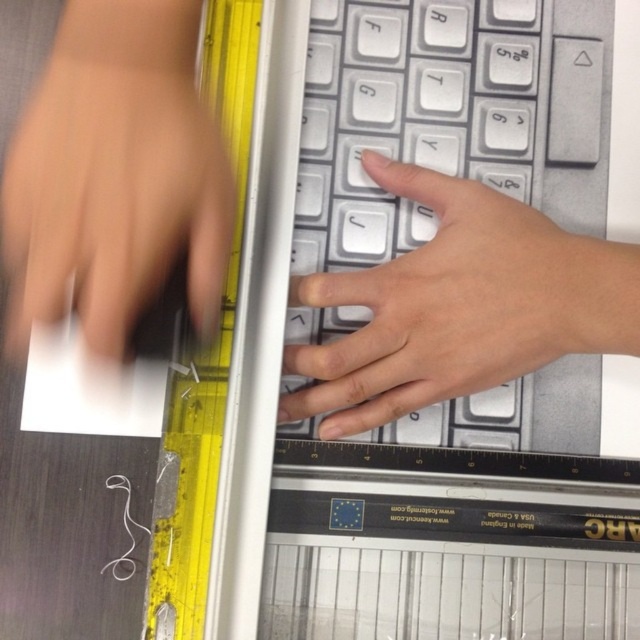
You are setting up a workspace and need to ensure the laptop is level. You have a yellow plastic ruler at left and a white matte hand at center. Which object should you use to check if the surface is level?

The yellow plastic ruler at left should be used to check if the surface is level because it is a level tool, while the white matte hand at center is just a hand and cannot measure levelness.

You are setting up a workspace and want to ensure the laptop is level. You have a yellow plastic ruler at left and notice a matte black hand at left nearby. Which object should you use to check if the laptop is level?

The yellow plastic ruler at left is the correct tool to use for checking the laptop level since it is a level tool. The matte black hand at left is just a hand and cannot be used for leveling.

You are a photographer trying to capture a close up of both hands on the keyboard. Since the matte black hand at left and the white matte hand at center are different sizes in the photo, which hand will appear smaller in the final image?

The matte black hand at left will appear smaller in the final image because its width is less than the white matte hand at center.